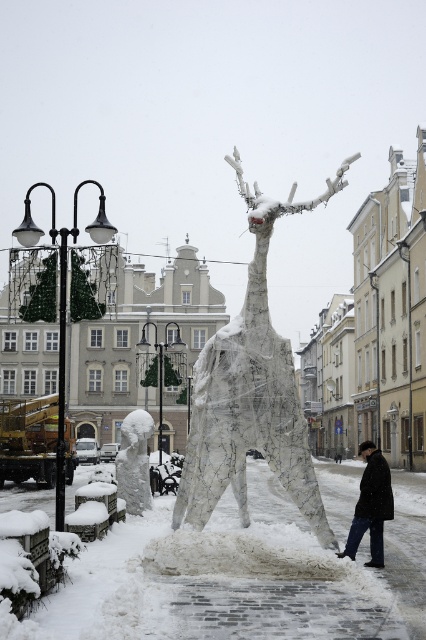
Can you confirm if black wool coat at lower center is wider than white frosty statue at lower left?

Yes, black wool coat at lower center is wider than white frosty statue at lower left.

Can you confirm if black wool coat at lower center is thinner than white frosty statue at lower left?

In fact, black wool coat at lower center might be wider than white frosty statue at lower left.

Between point (376, 490) and point (150, 497), which one is positioned behind?

The point (150, 497) is behind.

Where is `black wool coat at lower center`? The image size is (426, 640). black wool coat at lower center is located at coordinates (371, 506).

Between white wire mesh reindeer at center and white frosty statue at lower left, which one appears on the right side from the viewer's perspective?

Positioned to the right is white wire mesh reindeer at center.

Is point (233, 378) farther from viewer compared to point (132, 483)?

No, (233, 378) is in front of (132, 483).

Is point (235, 349) positioned in front of point (129, 465)?

Yes, point (235, 349) is closer to viewer.

In order to click on white wire mesh reindeer at center in this screenshot , I will do `click(250, 392)`.

Who is more forward, (245, 412) or (376, 490)?

Point (376, 490) is more forward.

Between point (261, 384) and point (370, 458), which one is positioned behind?

The point (261, 384) is behind.

Which is in front, point (210, 401) or point (380, 540)?

Point (380, 540) is more forward.

The image size is (426, 640). In order to click on white wire mesh reindeer at center in this screenshot , I will do `click(250, 392)`.